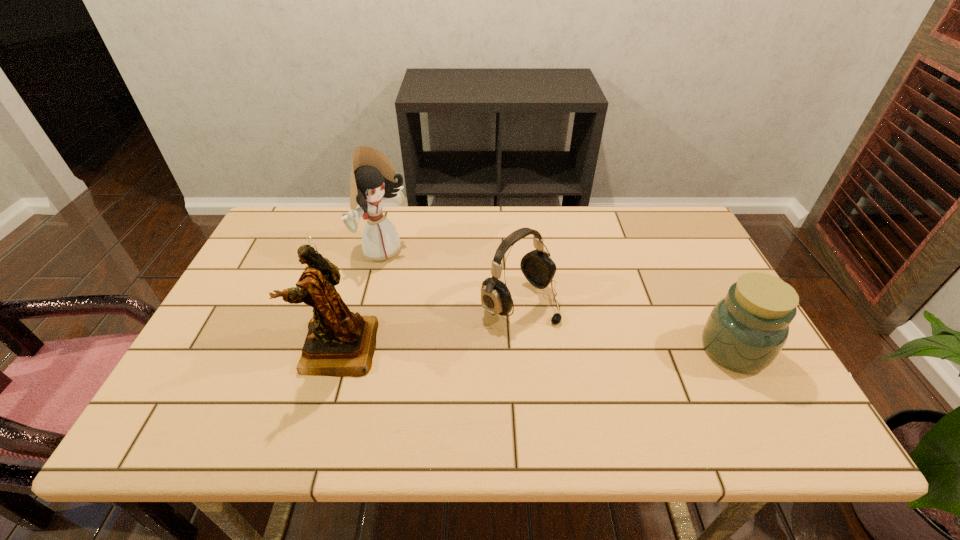
Where is `figurine`? figurine is located at coordinates (340, 343).

Identify the location of the rightmost object. This screenshot has height=540, width=960. (746, 330).

Locate an element on the screen. This screenshot has height=540, width=960. doll is located at coordinates (373, 179).

The height and width of the screenshot is (540, 960). Find the location of `headset`. headset is located at coordinates (537, 266).

Image resolution: width=960 pixels, height=540 pixels. I want to click on vacant area situated on the front-facing side of the figurine, so click(x=234, y=349).

Identify the location of free space located on the front-facing side of the figurine. The width and height of the screenshot is (960, 540). (280, 349).

Identify the location of free region located 0.100m on the front-facing side of the figurine. The image size is (960, 540). (259, 349).

I want to click on free space located on the back of the rightmost object, so click(711, 307).

Identify the location of vacant space positioned 0.090m at the front face of the doll. (422, 278).

Where is `free space located at the front face of the doll`? free space located at the front face of the doll is located at coordinates (428, 281).